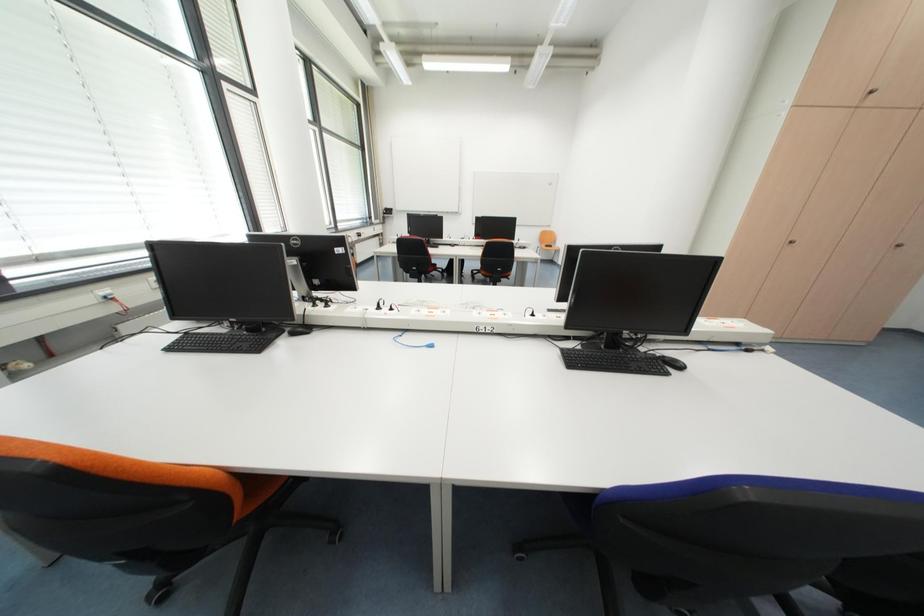
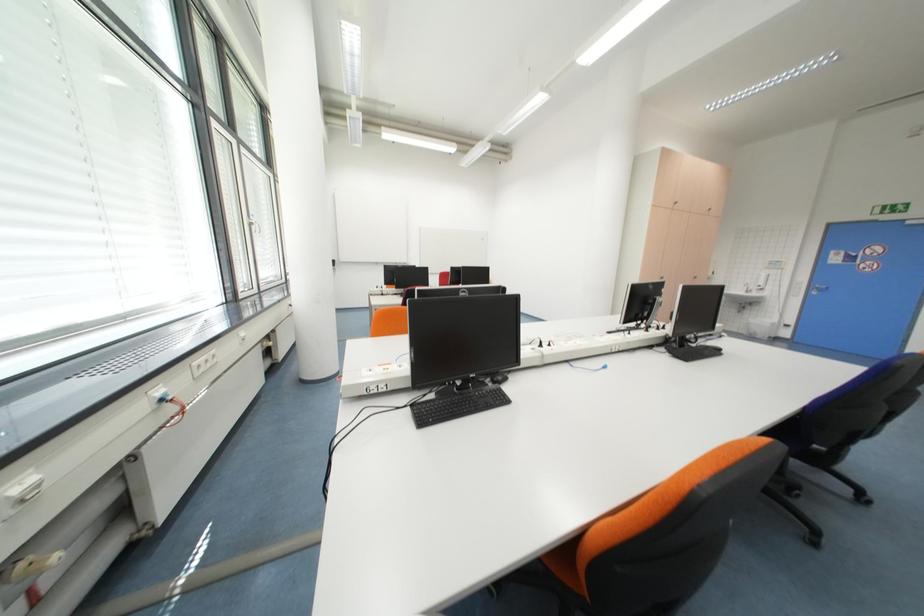
Question: What movement of the cameraman would produce the second image?

Choices:
 (A) Left
 (B) Right
 (C) Forward
 (D) Backward

Answer: (A)